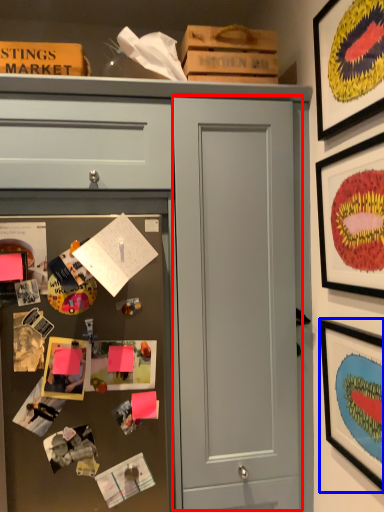
Question: Which object is further to the camera taking this photo, door (highlighted by a red box) or picture frame (highlighted by a blue box)?

Choices:
 (A) door
 (B) picture frame

Answer: (A)